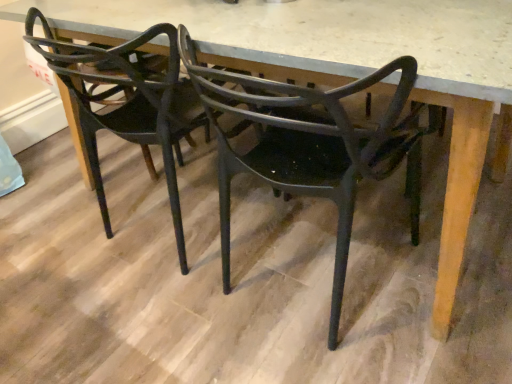
This screenshot has width=512, height=384. I want to click on free region on the left part of matte black chair at center, the second chair from the left, so click(136, 327).